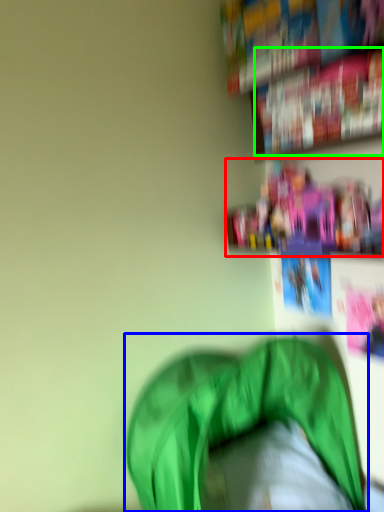
Question: Considering the real-world distances, which object is closest to shelf (highlighted by a red box)? bean bag chair (highlighted by a blue box) or book (highlighted by a green box).

Choices:
 (A) bean bag chair
 (B) book

Answer: (B)